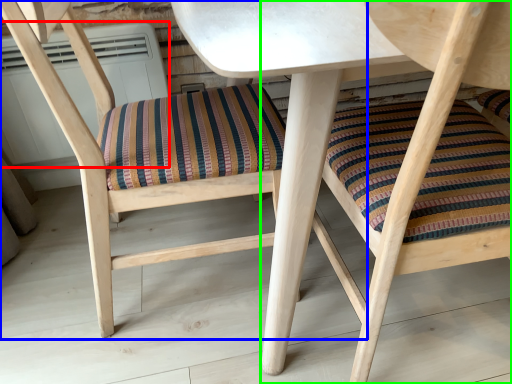
Question: Which object is positioned farthest from air conditioner (highlighted by a red box)? Select from chair (highlighted by a blue box) and chair (highlighted by a green box).

Choices:
 (A) chair
 (B) chair

Answer: (B)